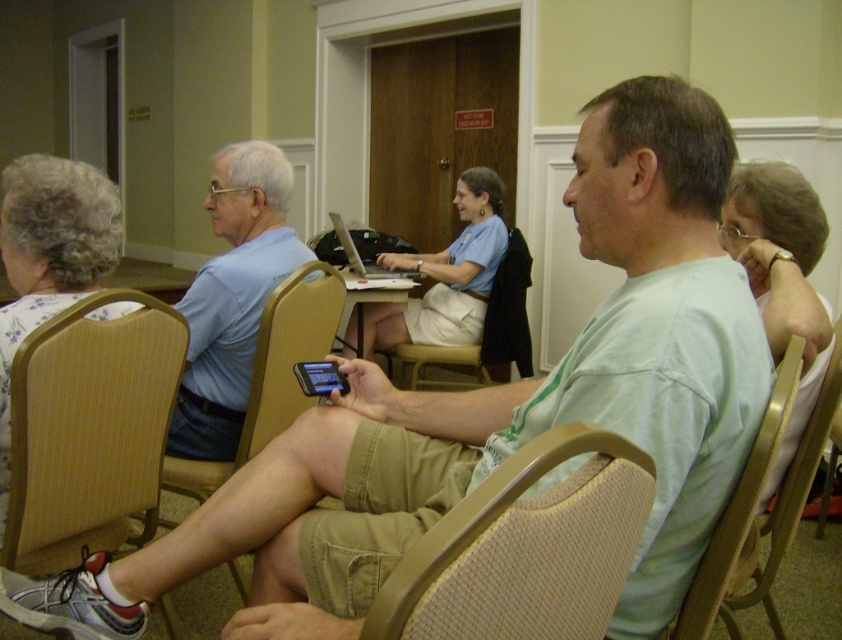
Question: Can you confirm if tan fabric chair at lower center is positioned above blue fabric skirt at center?

Choices:
 (A) yes
 (B) no

Answer: (B)

Question: Does white fabric shirt at upper right appear on the right side of beige fabric chair at center?

Choices:
 (A) yes
 (B) no

Answer: (A)

Question: Which is farther from the black glossy smartphone at center?

Choices:
 (A) tan fabric chair at lower center
 (B) wooden at left

Answer: (A)

Question: Does beige woven fabric chair at lower center have a smaller size compared to beige fabric chair at center?

Choices:
 (A) no
 (B) yes

Answer: (B)

Question: Which point appears closest to the camera in this image?

Choices:
 (A) (x=44, y=557)
 (B) (x=306, y=394)
 (C) (x=67, y=212)
 (D) (x=488, y=365)

Answer: (B)

Question: Which point is closer to the camera?

Choices:
 (A) (294, 246)
 (B) (441, 292)
 (C) (153, 317)
 (D) (57, 256)

Answer: (D)